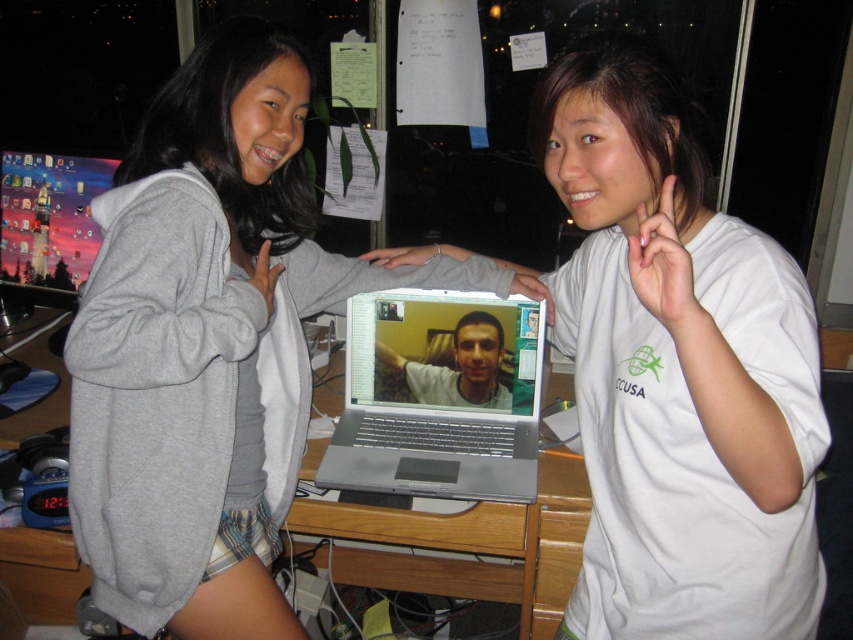
Can you confirm if matte plastic monitor at left is positioned above matte gray laptop at center?

Yes.

Based on the photo, which of these two, matte plastic monitor at left or matte gray laptop at center, stands shorter?

matte gray laptop at center

This screenshot has height=640, width=853. I want to click on matte plastic monitor at left, so click(x=48, y=224).

You are a GUI agent. You are given a task and a screenshot of the screen. Output one action in this format:
    pyautogui.click(x=<x>, y=<y>)
    Task: Click on the matte plastic monitor at left
    The width and height of the screenshot is (853, 640).
    Given the screenshot: What is the action you would take?
    pyautogui.click(x=48, y=224)

Which is below, silver metallic laptop at center or wooden desk at center?

wooden desk at center

Who is more forward, (519, 310) or (514, 572)?

Positioned in front is point (519, 310).

This screenshot has width=853, height=640. Find the location of `silver metallic laptop at center`. silver metallic laptop at center is located at coordinates (439, 396).

Between gray hoodie at center and matte plastic monitor at left, which one appears on the left side from the viewer's perspective?

From the viewer's perspective, matte plastic monitor at left appears more on the left side.

Which is below, gray hoodie at center or matte plastic monitor at left?

gray hoodie at center

Where is `gray hoodie at center`? gray hoodie at center is located at coordinates (210, 344).